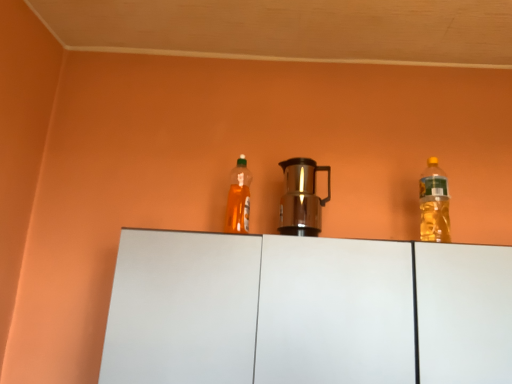
Measure the distance between point (x=442, y=179) and camera.

Point (x=442, y=179) is 4.31 feet away from camera.

In order to face shiny metallic coffee pot at center, should I rotate leftwards or rightwards?

A 6.651 degree turn to the right will do.

The image size is (512, 384). Find the location of `translucent yellow bottle at right, the 1th bottle from the right`. translucent yellow bottle at right, the 1th bottle from the right is located at coordinates (434, 204).

Is white matte cabinet at center oriented towards translucent orange bottle at center, which is counted as the 1th bottle, starting from the left?

No, white matte cabinet at center is not aimed at translucent orange bottle at center, which is counted as the 1th bottle, starting from the left.

Which object is positioned more to the right, white matte cabinet at center or translucent orange bottle at center, which is counted as the 1th bottle, starting from the left?

white matte cabinet at center is more to the right.

Does point (326, 348) come behind point (234, 215)?

No, it is not.

How far apart are white matte cabinet at center and translucent orange bottle at center, which is counted as the 1th bottle, starting from the left?

They are 50.20 centimeters apart.

Could shiny metallic coffee pot at center be considered to be inside translucent orange bottle at center, placed as the 2th bottle when sorted from right to left?

No, translucent orange bottle at center, placed as the 2th bottle when sorted from right to left, does not contain shiny metallic coffee pot at center.

From the image's perspective, is translucent orange bottle at center, placed as the 2th bottle when sorted from right to left, on top of shiny metallic coffee pot at center?

Yes, from the image's perspective, translucent orange bottle at center, placed as the 2th bottle when sorted from right to left, is on top of shiny metallic coffee pot at center.

Could you tell me if translucent orange bottle at center, placed as the 2th bottle when sorted from right to left, is turned towards shiny metallic coffee pot at center?

No.

From the image's perspective, is shiny metallic coffee pot at center over translucent orange bottle at center, which is counted as the 1th bottle, starting from the left?

No.

In order to click on bottle on the left of shiny metallic coffee pot at center in this screenshot , I will do `click(238, 199)`.

Is shiny metallic coffee pot at center positioned behind translucent orange bottle at center, placed as the 2th bottle when sorted from right to left?

No, it is not.

From a real-world perspective, which object stands above the other?

translucent orange bottle at center, which is counted as the 1th bottle, starting from the left, is physically above.

Is white matte cabinet at center to the right of translucent yellow bottle at right, the 1th bottle from the right, from the viewer's perspective?

No, white matte cabinet at center is not to the right of translucent yellow bottle at right, the 1th bottle from the right.

Is white matte cabinet at center bigger or smaller than translucent yellow bottle at right, the 1th bottle from the right?

white matte cabinet at center is bigger than translucent yellow bottle at right, the 1th bottle from the right.

Which object is wider, white matte cabinet at center or translucent yellow bottle at right, the 1th bottle from the right?

white matte cabinet at center.

Is white matte cabinet at center positioned in front of translucent yellow bottle at right, the 1th bottle from the right?

Yes, the depth of white matte cabinet at center is less than that of translucent yellow bottle at right, the 1th bottle from the right.

Where is `kitchen appliance on the left of translucent yellow bottle at right, the 1th bottle from the right`? This screenshot has height=384, width=512. kitchen appliance on the left of translucent yellow bottle at right, the 1th bottle from the right is located at coordinates (302, 198).

In terms of height, does shiny metallic coffee pot at center look taller or shorter compared to translucent yellow bottle at right, the 1th bottle from the right?

Clearly, shiny metallic coffee pot at center is shorter compared to translucent yellow bottle at right, the 1th bottle from the right.

Is the surface of shiny metallic coffee pot at center in direct contact with translucent yellow bottle at right, the 2th bottle in the left-to-right sequence?

shiny metallic coffee pot at center and translucent yellow bottle at right, the 2th bottle in the left-to-right sequence, are clearly separated.

Considering the positions of objects shiny metallic coffee pot at center and translucent yellow bottle at right, the 2th bottle in the left-to-right sequence, in the image provided, who is in front, shiny metallic coffee pot at center or translucent yellow bottle at right, the 2th bottle in the left-to-right sequence,?

shiny metallic coffee pot at center is more forward.

Which object is thinner, translucent orange bottle at center, which is counted as the 1th bottle, starting from the left, or white matte cabinet at center?

Thinner between the two is translucent orange bottle at center, which is counted as the 1th bottle, starting from the left.

From the image's perspective, which is below, translucent orange bottle at center, placed as the 2th bottle when sorted from right to left, or white matte cabinet at center?

white matte cabinet at center.

Is translucent orange bottle at center, placed as the 2th bottle when sorted from right to left, facing towards white matte cabinet at center?

No.

Is translucent orange bottle at center, placed as the 2th bottle when sorted from right to left, taller than white matte cabinet at center?

Incorrect, the height of translucent orange bottle at center, placed as the 2th bottle when sorted from right to left, is not larger of that of white matte cabinet at center.

Is translucent yellow bottle at right, the 1th bottle from the right, positioned with its back to shiny metallic coffee pot at center?

translucent yellow bottle at right, the 1th bottle from the right, is not turned away from shiny metallic coffee pot at center.

I want to click on bottle below the shiny metallic coffee pot at center (from the image's perspective), so click(x=434, y=204).

Is translucent yellow bottle at right, the 2th bottle in the left-to-right sequence, positioned behind shiny metallic coffee pot at center?

Yes, translucent yellow bottle at right, the 2th bottle in the left-to-right sequence, is further from the viewer.

Can you confirm if translucent yellow bottle at right, the 1th bottle from the right, is positioned to the right of shiny metallic coffee pot at center?

Yes, translucent yellow bottle at right, the 1th bottle from the right, is to the right of shiny metallic coffee pot at center.

Locate an element on the screen. The width and height of the screenshot is (512, 384). cabinetry below the translucent orange bottle at center, which is counted as the 1th bottle, starting from the left (from the image's perspective) is located at coordinates (305, 311).

The height and width of the screenshot is (384, 512). What are the coordinates of `kitchen appliance that appears on the right of translucent orange bottle at center, placed as the 2th bottle when sorted from right to left` in the screenshot? It's located at (302, 198).

Estimate the real-world distances between objects in this image. Which object is further from white matte cabinet at center, shiny metallic coffee pot at center or translucent yellow bottle at right, the 2th bottle in the left-to-right sequence?

translucent yellow bottle at right, the 2th bottle in the left-to-right sequence, is positioned further to the anchor white matte cabinet at center.

Based on their spatial positions, is translucent yellow bottle at right, the 2th bottle in the left-to-right sequence, or translucent orange bottle at center, placed as the 2th bottle when sorted from right to left, further from shiny metallic coffee pot at center?

translucent yellow bottle at right, the 2th bottle in the left-to-right sequence.

Estimate the real-world distances between objects in this image. Which object is closer to shiny metallic coffee pot at center, white matte cabinet at center or translucent orange bottle at center, which is counted as the 1th bottle, starting from the left?

translucent orange bottle at center, which is counted as the 1th bottle, starting from the left, lies closer to shiny metallic coffee pot at center than the other object.

From the picture: Estimate the real-world distances between objects in this image. Which object is further from translucent yellow bottle at right, the 1th bottle from the right, white matte cabinet at center or translucent orange bottle at center, placed as the 2th bottle when sorted from right to left?

The object further to translucent yellow bottle at right, the 1th bottle from the right, is translucent orange bottle at center, placed as the 2th bottle when sorted from right to left.

Based on their spatial positions, is white matte cabinet at center or shiny metallic coffee pot at center closer to translucent orange bottle at center, which is counted as the 1th bottle, starting from the left?

Among the two, shiny metallic coffee pot at center is located nearer to translucent orange bottle at center, which is counted as the 1th bottle, starting from the left.

Considering their positions, is white matte cabinet at center positioned closer to shiny metallic coffee pot at center than translucent yellow bottle at right, the 2th bottle in the left-to-right sequence?

Based on the image, white matte cabinet at center appears to be nearer to shiny metallic coffee pot at center.

Based on their spatial positions, is shiny metallic coffee pot at center or translucent orange bottle at center, placed as the 2th bottle when sorted from right to left, further from white matte cabinet at center?

Based on the image, translucent orange bottle at center, placed as the 2th bottle when sorted from right to left, appears to be further to white matte cabinet at center.

Which object lies nearer to the anchor point translucent yellow bottle at right, the 2th bottle in the left-to-right sequence, white matte cabinet at center or shiny metallic coffee pot at center?

shiny metallic coffee pot at center is closer to translucent yellow bottle at right, the 2th bottle in the left-to-right sequence.

The width and height of the screenshot is (512, 384). In order to click on cabinetry between translucent orange bottle at center, placed as the 2th bottle when sorted from right to left, and translucent yellow bottle at right, the 1th bottle from the right, from left to right in this screenshot , I will do `click(305, 311)`.

Locate an element on the screen. kitchen appliance between translucent orange bottle at center, placed as the 2th bottle when sorted from right to left, and translucent yellow bottle at right, the 2th bottle in the left-to-right sequence, in the horizontal direction is located at coordinates (302, 198).

Locate an element on the screen. Image resolution: width=512 pixels, height=384 pixels. kitchen appliance between translucent orange bottle at center, placed as the 2th bottle when sorted from right to left, and white matte cabinet at center from top to bottom is located at coordinates (302, 198).

You are a GUI agent. You are given a task and a screenshot of the screen. Output one action in this format:
    pyautogui.click(x=<x>, y=<y>)
    Task: Click on the cabinetry between shiny metallic coffee pot at center and translucent yellow bottle at right, the 1th bottle from the right, from left to right
    The width and height of the screenshot is (512, 384).
    Given the screenshot: What is the action you would take?
    pyautogui.click(x=305, y=311)